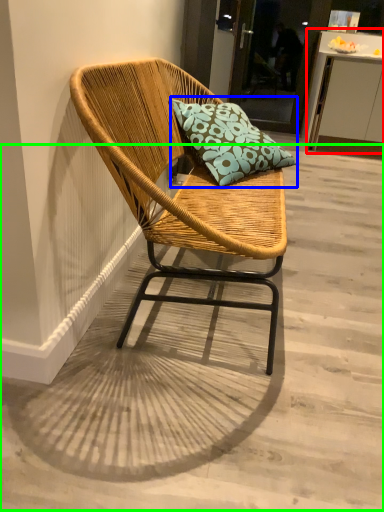
Question: Considering the real-world distances, which object is farthest from table (highlighted by a red box)? pillow (highlighted by a blue box) or concrete (highlighted by a green box)?

Choices:
 (A) pillow
 (B) concrete

Answer: (B)